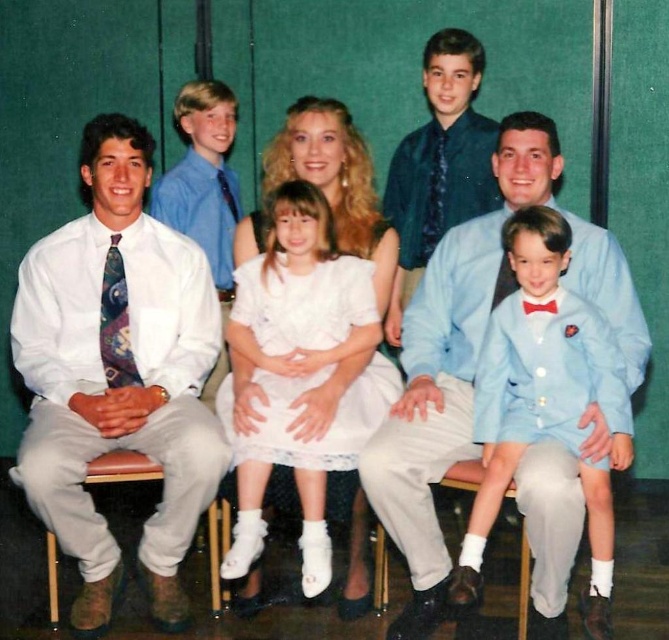
You are a photographer adjusting the camera settings. You notice the white lace dress at center and the white fabric chair at lower center in the frame. Which object should you focus on first if you want to ensure both are in focus without adjusting the camera depth of field?

The white lace dress at center is taller than the white fabric chair at lower center, so focusing on the white lace dress at center first will ensure both are within the depth of field since it is the closer object.

In the family photo, there is a white lace dress at center and a brown leather chair at lower right. Which object is positioned more to the left side of the image?

The white lace dress at center is positioned to the left of the brown leather chair at lower right, so it is more to the left side of the image.

From the picture: You are a photographer adjusting the lighting for a family photo. The white lace dress at center and the brown leather chair at lower left are in your frame. The light stand is currently 20 inches away from the chair. Is the light stand positioned far enough from the chair to avoid casting a shadow on the dress?

The white lace dress at center is 18.85 inches from the brown leather chair at lower left. Since the light stand is 20 inches away from the chair, it is positioned farther than the distance between the dress and the chair. This means the light stand is far enough away to avoid casting a shadow on the dress.